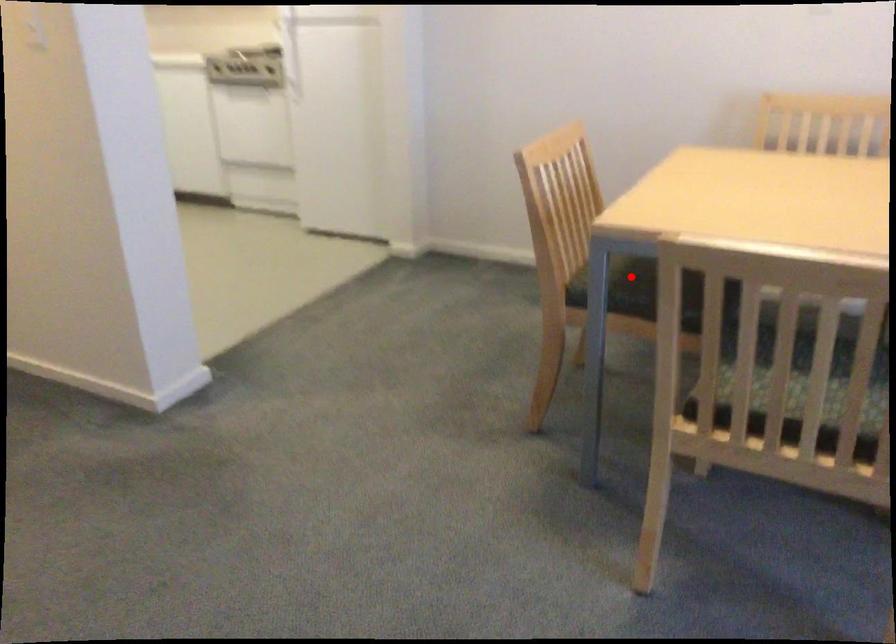
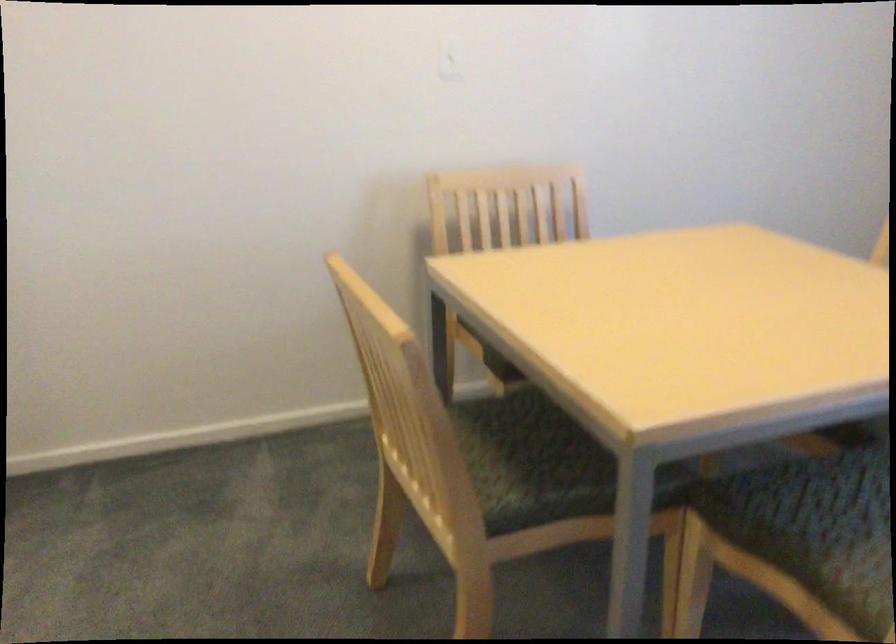
The point at the highlighted location is marked in the first image. Where is the corresponding point in the second image?

(530, 462)